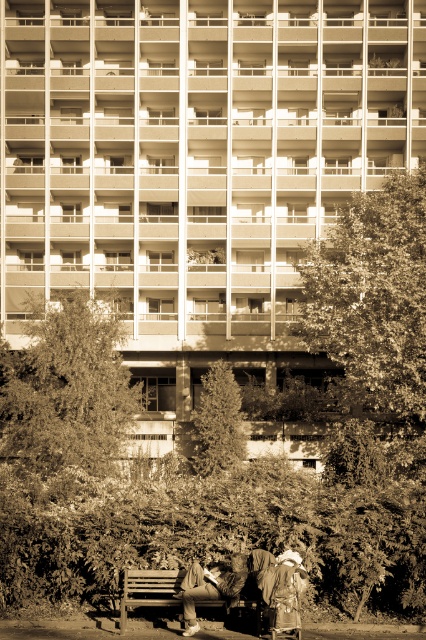
Question: Among these points, which one is farthest from the camera?

Choices:
 (A) (244, 580)
 (B) (423, 172)
 (C) (158, 579)

Answer: (B)

Question: Can you confirm if green leafy tree at right is positioned above green leafy tree at center?

Choices:
 (A) yes
 (B) no

Answer: (A)

Question: Which of these objects is positioned farthest from the green textured tree at center?

Choices:
 (A) leather jacket at lower center
 (B) wooden bench at lower center
 (C) matte black jacket at lower center

Answer: (A)

Question: Which point is farther to the camera?

Choices:
 (A) (229, 609)
 (B) (192, 605)

Answer: (A)

Question: Is the position of green textured tree at center more distant than that of matte black jacket at lower center?

Choices:
 (A) yes
 (B) no

Answer: (A)

Question: Can you confirm if leather jacket at lower center is positioned above green textured tree at center?

Choices:
 (A) no
 (B) yes

Answer: (A)